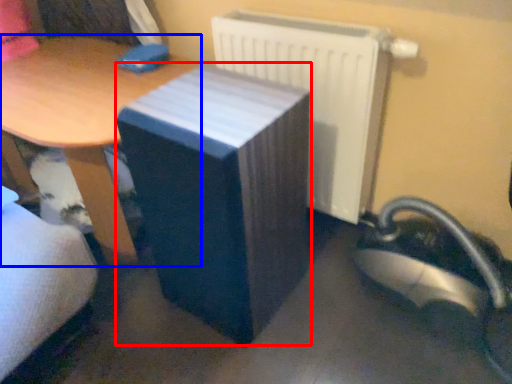
Question: Which object is further to the camera taking this photo, table (highlighted by a red box) or table (highlighted by a blue box)?

Choices:
 (A) table
 (B) table

Answer: (B)